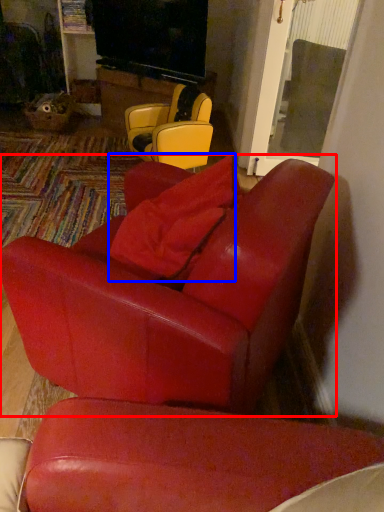
Question: Which object appears closest to the camera in this image, chair (highlighted by a red box) or pillow (highlighted by a blue box)?

Choices:
 (A) chair
 (B) pillow

Answer: (A)